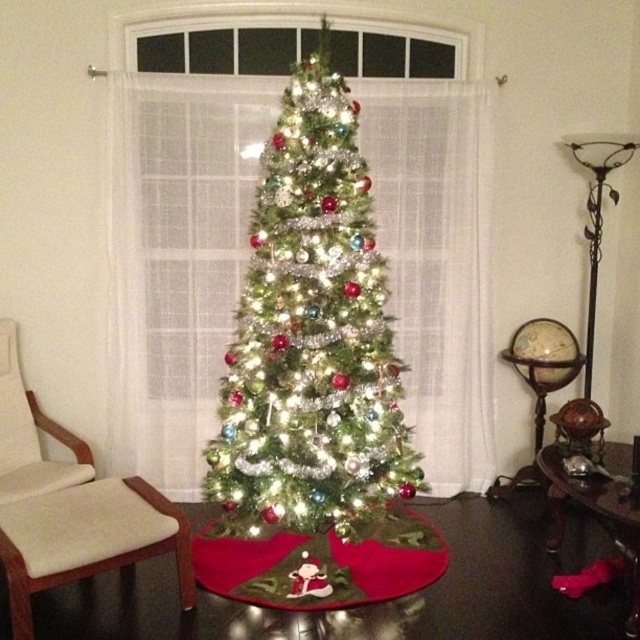
You are decorating a living room and want to place a large potted plant between the iridescent shiny tree at center and the light brown wooden stool at lower left. Considering their sizes, will the plant fit comfortably between them?

The iridescent shiny tree at center is bigger than the light brown wooden stool at lower left. Since the tree is larger, there should be enough space between them to place the large potted plant comfortably.

You are standing in the festive indoor setting with the Christmas tree. There is a point at coordinates (310, 333). What object is located at that point?

The point at coordinates (310, 333) is where the iridescent shiny tree at center is located.

You are a visitor in this festive room and want to take a photo of both the iridescent shiny tree at center and the light brown wooden stool at lower left. Since you want the tree to appear larger in the photo than the stool, where should you stand relative to them?

To make the iridescent shiny tree at center appear larger than the light brown wooden stool at lower left in the photo, you should stand closer to the iridescent shiny tree at center. Since the tree is much taller than the stool, positioning yourself nearer to the tree will emphasize its size relative to the stool.